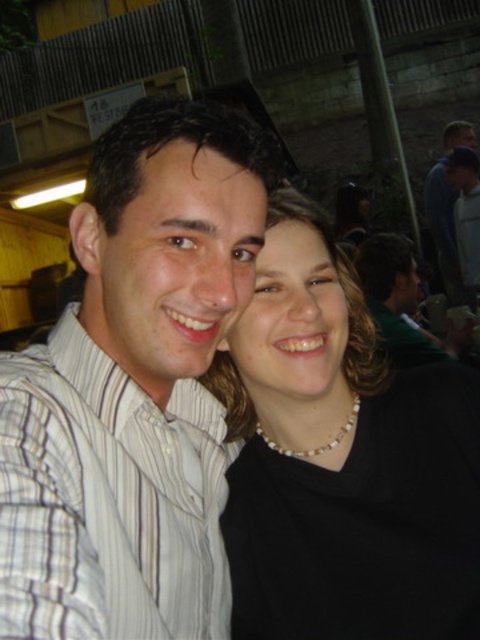
Question: Can you confirm if pearl necklace at center is wider than dark blue shirt at upper right?

Choices:
 (A) yes
 (B) no

Answer: (B)

Question: Which point appears closest to the camera in this image?

Choices:
 (A) coord(397,324)
 (B) coord(450,225)
 (C) coord(322,301)

Answer: (C)

Question: Estimate the real-world distances between objects in this image. Which object is farther from the matte black shirt at upper right?

Choices:
 (A) pearl necklace at center
 (B) dark blue shirt at upper right

Answer: (B)

Question: Is white striped shirt at left bigger than matte black shirt at upper right?

Choices:
 (A) no
 (B) yes

Answer: (A)

Question: Which of the following is the closest to the observer?

Choices:
 (A) dark blue shirt at upper right
 (B) white striped shirt at left
 (C) matte black shirt at upper right
 (D) pearl necklace at center

Answer: (B)

Question: Can you confirm if pearl necklace at center is positioned above white striped shirt at left?

Choices:
 (A) no
 (B) yes

Answer: (B)